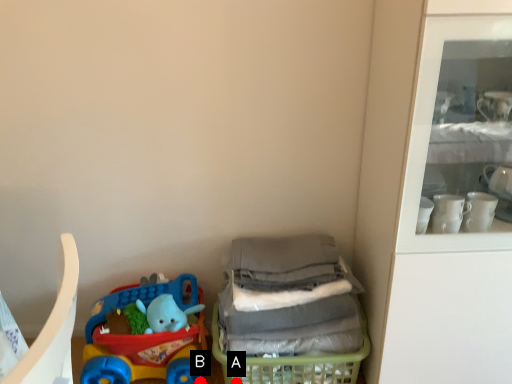
Question: Two points are circled on the image, labeled by A and B beside each circle. Among these points, which one is nearest to the camera?

Choices:
 (A) A is closer
 (B) B is closer

Answer: (A)